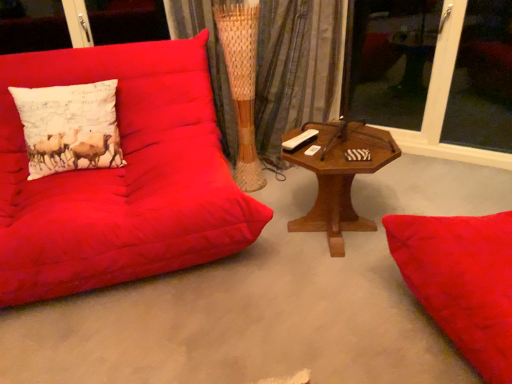
Where is `free space in front of transparent glass window at upper right, marked as the 2th window screen in a right-to-left arrangement`? The height and width of the screenshot is (384, 512). free space in front of transparent glass window at upper right, marked as the 2th window screen in a right-to-left arrangement is located at coordinates (447, 183).